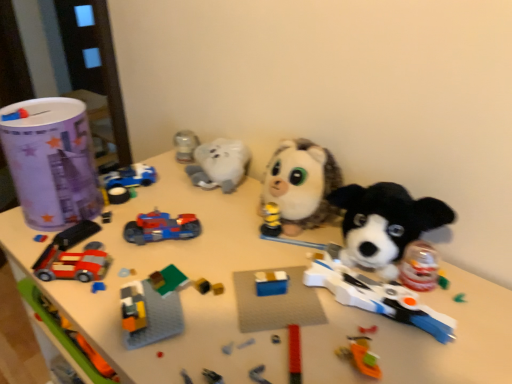
Identify the location of vacant space to the right of paper cup at left, marked as the fifth toy in a right-to-left arrangement. tap(147, 210).